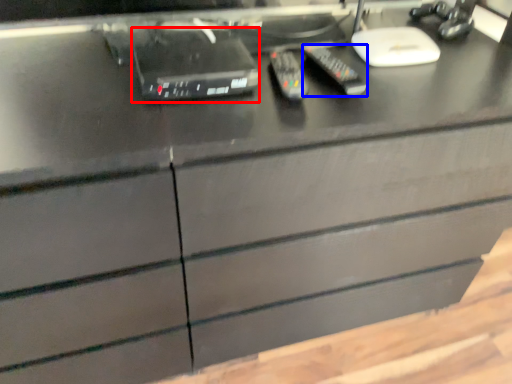
Question: Which point is closer to the camera, equipment (highlighted by a red box) or control (highlighted by a blue box)?

Choices:
 (A) equipment
 (B) control

Answer: (A)